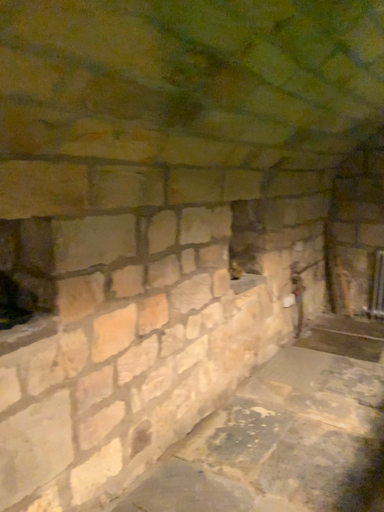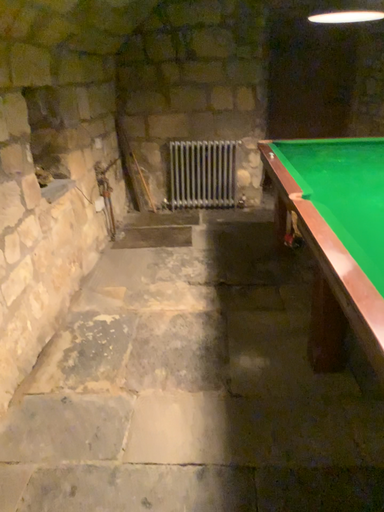
Question: How did the camera likely rotate when shooting the video?

Choices:
 (A) rotated left
 (B) rotated right

Answer: (B)